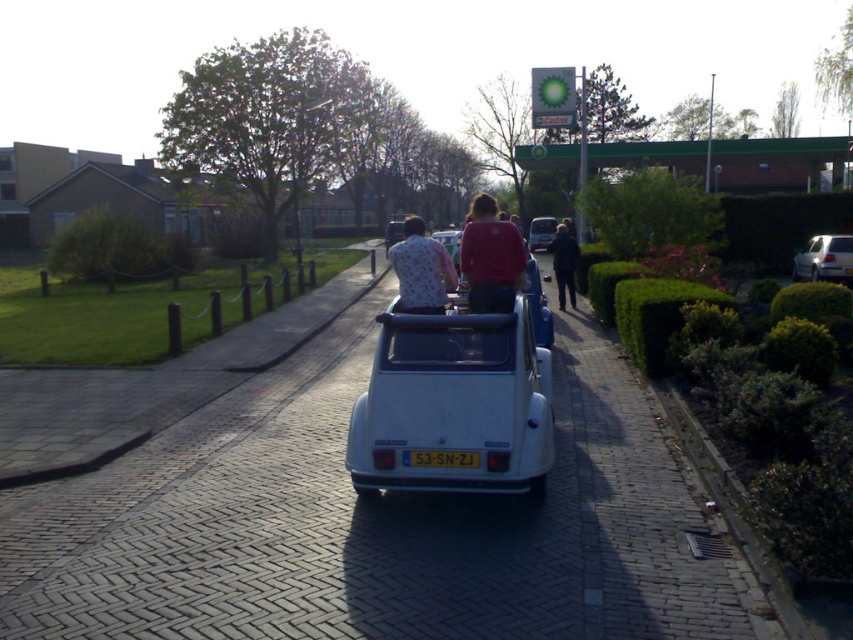
You are a parking attendant and need to ensure that all license plates on vehicles are visible. You see the yellow matte license plate at center and the matte white car at center. Which object is narrower in width?

The yellow matte license plate at center is thinner than the matte white car at center, so the yellow matte license plate at center is narrower in width.

You are standing at the camera position and want to walk to both points. Which point should you reach first, point (413, 458) or point (537, 224)?

Point (413, 458) is closer to the camera than point (537, 224), so you should reach point (413, 458) first.